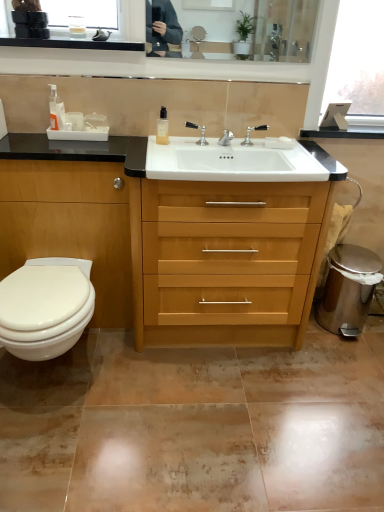
Question: From the image's perspective, does polished chrome faucet at center appear higher than translucent plastic bottle at upper left, marked as the first toiletry in a left-to-right arrangement?

Choices:
 (A) yes
 (B) no

Answer: (B)

Question: Does polished chrome faucet at center have a larger size compared to translucent plastic bottle at upper left, marked as the first toiletry in a left-to-right arrangement?

Choices:
 (A) yes
 (B) no

Answer: (B)

Question: Can you confirm if polished chrome faucet at center is taller than translucent plastic bottle at upper left, acting as the second toiletry starting from the right?

Choices:
 (A) yes
 (B) no

Answer: (B)

Question: Can you confirm if polished chrome faucet at center is thinner than translucent plastic bottle at upper left, marked as the first toiletry in a left-to-right arrangement?

Choices:
 (A) yes
 (B) no

Answer: (A)

Question: Could you tell me if polished chrome faucet at center is facing translucent plastic bottle at upper left, acting as the second toiletry starting from the right?

Choices:
 (A) no
 (B) yes

Answer: (A)

Question: Could translucent plastic bottle at upper left, marked as the first toiletry in a left-to-right arrangement, be considered to be inside polished chrome faucet at center?

Choices:
 (A) no
 (B) yes

Answer: (A)

Question: From the image's perspective, is polished silver faucet at center beneath light wood/finish chest of drawers at center?

Choices:
 (A) no
 (B) yes

Answer: (A)

Question: Can light wood/finish chest of drawers at center be found inside polished silver faucet at center?

Choices:
 (A) yes
 (B) no

Answer: (B)

Question: From the image's perspective, would you say polished silver faucet at center is positioned over light wood/finish chest of drawers at center?

Choices:
 (A) yes
 (B) no

Answer: (A)

Question: Considering the relative sizes of polished silver faucet at center and light wood/finish chest of drawers at center in the image provided, is polished silver faucet at center wider than light wood/finish chest of drawers at center?

Choices:
 (A) yes
 (B) no

Answer: (B)

Question: Considering the relative positions of polished silver faucet at center and light wood/finish chest of drawers at center in the image provided, is polished silver faucet at center in front of light wood/finish chest of drawers at center?

Choices:
 (A) yes
 (B) no

Answer: (B)

Question: Does polished silver faucet at center appear on the right side of light wood/finish chest of drawers at center?

Choices:
 (A) yes
 (B) no

Answer: (B)

Question: Is polished chrome faucet at center oriented towards polished silver faucet at center?

Choices:
 (A) no
 (B) yes

Answer: (A)